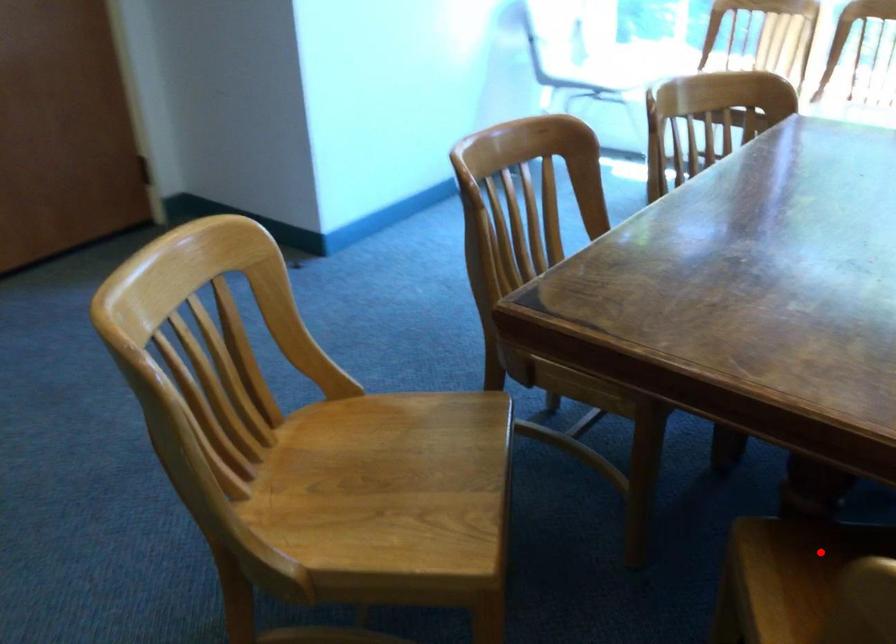
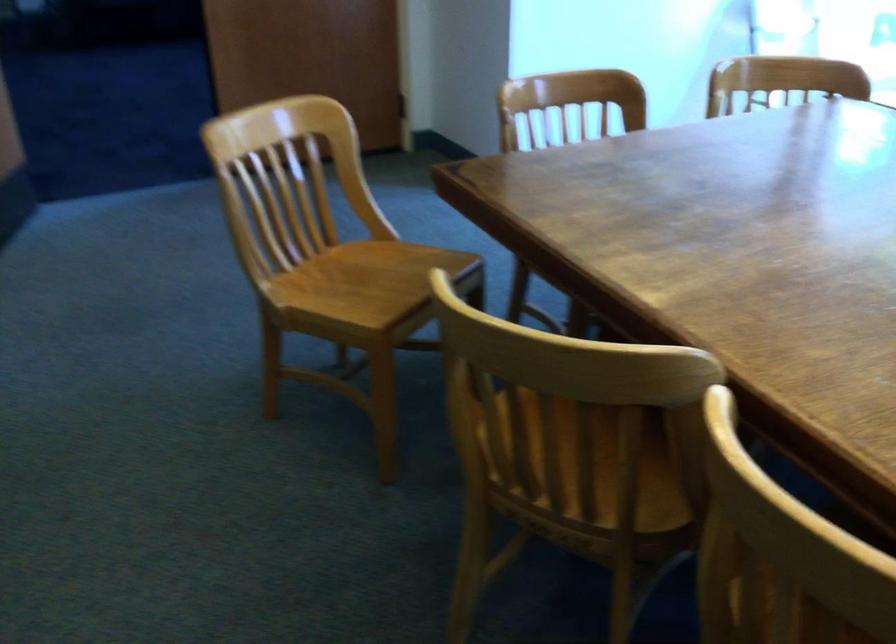
Question: I am providing you with two images of the same scene from different viewpoints. A red point is marked on the first image. At the location where the point appears in image 1, is it still visible in image 2?

Choices:
 (A) Yes
 (B) No

Answer: (B)